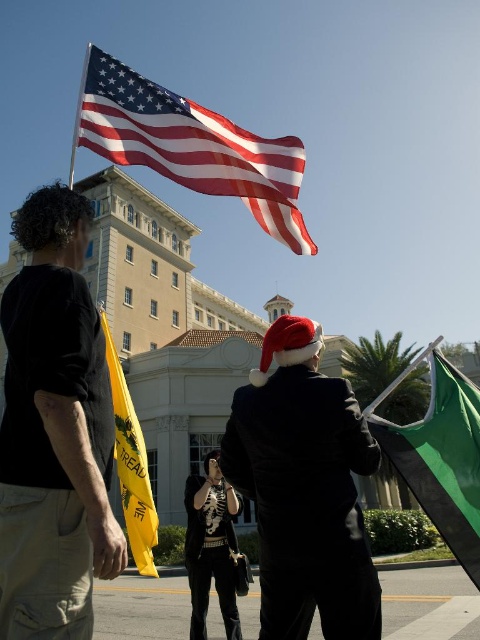
Question: Which point appears closest to the camera in this image?

Choices:
 (A) [x=107, y=52]
 (B) [x=299, y=333]
 (C) [x=452, y=369]
 (D) [x=288, y=340]

Answer: (D)

Question: Which object is positioned closest to the black leather jacket at center?

Choices:
 (A) matte black suit at center
 (B) black cotton t-shirt at left
 (C) red velvet santa hat at center

Answer: (A)

Question: Which object appears closest to the camera in this image?

Choices:
 (A) red velvet santa hat at center
 (B) bright red fabric flag at upper center
 (C) yellow fabric flag at lower left

Answer: (C)

Question: Is black cotton t-shirt at left to the right of matte black suit at center from the viewer's perspective?

Choices:
 (A) no
 (B) yes

Answer: (A)

Question: Can you confirm if black leather jacket at center is positioned below yellow fabric flag at lower left?

Choices:
 (A) yes
 (B) no

Answer: (A)

Question: Does green fabric flag at right have a smaller size compared to black leather jacket at center?

Choices:
 (A) yes
 (B) no

Answer: (B)